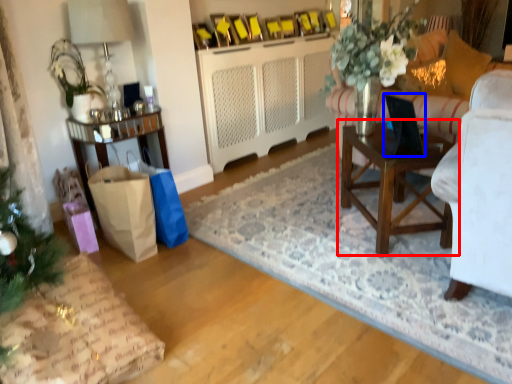
Question: Which object is closer to the camera taking this photo, table (highlighted by a red box) or laptop (highlighted by a blue box)?

Choices:
 (A) table
 (B) laptop

Answer: (B)